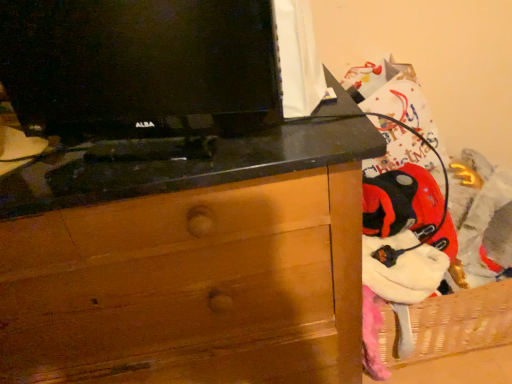
This screenshot has height=384, width=512. Describe the element at coordinates (140, 67) in the screenshot. I see `black glossy tv at upper left` at that location.

Image resolution: width=512 pixels, height=384 pixels. I want to click on black glossy tv at upper left, so click(x=140, y=67).

Describe the element at coordinates (189, 286) in the screenshot. I see `wooden chest of drawers at center` at that location.

At what (x,y) coordinates should I click in order to perform the action: click on wooden chest of drawers at center. Please return your answer as a coordinate pair (x, y). Looking at the image, I should click on (189, 286).

Image resolution: width=512 pixels, height=384 pixels. Identify the location of black glossy tv at upper left. (140, 67).

Is wooden chest of drawers at center to the left of black glossy tv at upper left from the viewer's perspective?

Yes, wooden chest of drawers at center is to the left of black glossy tv at upper left.

Is the depth of wooden chest of drawers at center less than that of black glossy tv at upper left?

No, wooden chest of drawers at center is further to the viewer.

Is point (260, 302) farther from camera compared to point (51, 135)?

Yes, it is behind point (51, 135).

From the image's perspective, is wooden chest of drawers at center positioned above or below black glossy tv at upper left?

wooden chest of drawers at center is below black glossy tv at upper left.

From a real-world perspective, is wooden chest of drawers at center positioned above or below black glossy tv at upper left?

Clearly, from a real-world perspective, wooden chest of drawers at center is below black glossy tv at upper left.

Between wooden chest of drawers at center and black glossy tv at upper left, which one has larger width?

With larger width is wooden chest of drawers at center.

Considering the sizes of wooden chest of drawers at center and black glossy tv at upper left in the image, is wooden chest of drawers at center taller or shorter than black glossy tv at upper left?

In the image, wooden chest of drawers at center appears to be taller than black glossy tv at upper left.

Between wooden chest of drawers at center and black glossy tv at upper left, which one has larger size?

With larger size is wooden chest of drawers at center.

Can black glossy tv at upper left be found inside wooden chest of drawers at center?

Actually, black glossy tv at upper left is outside wooden chest of drawers at center.

Are wooden chest of drawers at center and black glossy tv at upper left making contact?

wooden chest of drawers at center and black glossy tv at upper left are not in contact.

Is black glossy tv at upper left at the back of wooden chest of drawers at center?

No.

Can you tell me how much wooden chest of drawers at center and black glossy tv at upper left differ in facing direction?

There is a 15.4-degree angle between the facing directions of wooden chest of drawers at center and black glossy tv at upper left.

This screenshot has height=384, width=512. What are the coordinates of `television in front of the wooden chest of drawers at center` in the screenshot? It's located at (140, 67).

Is black glossy tv at upper left at the right side of wooden chest of drawers at center?

Correct, you'll find black glossy tv at upper left to the right of wooden chest of drawers at center.

Who is more distant, black glossy tv at upper left or wooden chest of drawers at center?

wooden chest of drawers at center is further from the camera.

Is point (88, 117) positioned in front of point (114, 364)?

Yes, point (88, 117) is in front of point (114, 364).

From the image's perspective, relative to wooden chest of drawers at center, is black glossy tv at upper left above or below?

From the image's perspective, black glossy tv at upper left appears above wooden chest of drawers at center.

From a real-world perspective, is black glossy tv at upper left on top of wooden chest of drawers at center?

Indeed, from a real-world perspective, black glossy tv at upper left stands above wooden chest of drawers at center.

Is black glossy tv at upper left wider than wooden chest of drawers at center?

Incorrect, the width of black glossy tv at upper left does not surpass that of wooden chest of drawers at center.

From their relative heights in the image, would you say black glossy tv at upper left is taller or shorter than wooden chest of drawers at center?

black glossy tv at upper left is shorter than wooden chest of drawers at center.

Is black glossy tv at upper left bigger or smaller than wooden chest of drawers at center?

black glossy tv at upper left is smaller than wooden chest of drawers at center.

Would you say black glossy tv at upper left is inside or outside wooden chest of drawers at center?

black glossy tv at upper left is outside wooden chest of drawers at center.

Is black glossy tv at upper left in contact with wooden chest of drawers at center?

No, black glossy tv at upper left is not beside wooden chest of drawers at center.

Looking at this image, is black glossy tv at upper left turned away from wooden chest of drawers at center?

No, black glossy tv at upper left is not facing away from wooden chest of drawers at center.

What's the angular difference between black glossy tv at upper left and wooden chest of drawers at center's facing directions?

The facing directions of black glossy tv at upper left and wooden chest of drawers at center are 15.4 degrees apart.

Identify the location of television in front of the wooden chest of drawers at center. This screenshot has width=512, height=384. (140, 67).

Where is `television above the wooden chest of drawers at center (from a real-world perspective)`? The width and height of the screenshot is (512, 384). television above the wooden chest of drawers at center (from a real-world perspective) is located at coordinates (140, 67).

At what (x,y) coordinates should I click in order to perform the action: click on the chest of drawers located below the black glossy tv at upper left (from the image's perspective). Please return your answer as a coordinate pair (x, y). This screenshot has height=384, width=512. Looking at the image, I should click on (189, 286).